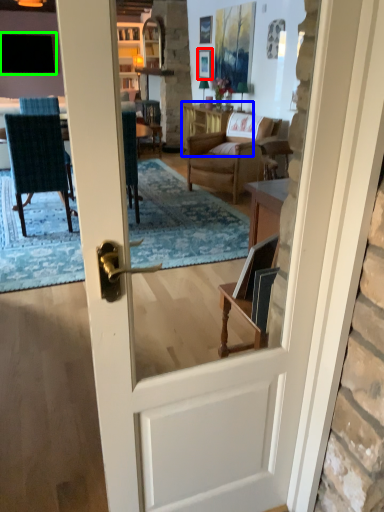
Question: Estimate the real-world distances between objects in this image. Which object is closer to picture frame (highlighted by a red box), table (highlighted by a blue box) or window (highlighted by a green box)?

Choices:
 (A) table
 (B) window

Answer: (A)